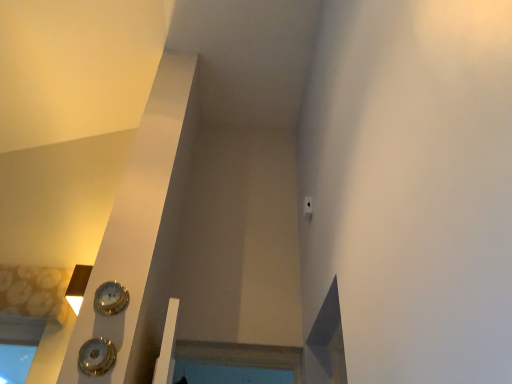
Question: Would you say gold metallic clock at lower left, the 2th clock when ordered from bottom to top, is outside shiny silver clock at lower left, which is the first clock in front-to-back order?

Choices:
 (A) yes
 (B) no

Answer: (A)

Question: From a real-world perspective, is gold metallic clock at lower left, acting as the 1th clock starting from the back, positioned over shiny silver clock at lower left, which is the first clock in front-to-back order, based on gravity?

Choices:
 (A) no
 (B) yes

Answer: (B)

Question: Is gold metallic clock at lower left, acting as the 1th clock starting from the back, not near shiny silver clock at lower left, placed as the second clock when sorted from top to bottom?

Choices:
 (A) yes
 (B) no

Answer: (B)

Question: From a real-world perspective, is gold metallic clock at lower left, which is the 1th clock from top to bottom, below shiny silver clock at lower left, placed as the second clock when sorted from top to bottom?

Choices:
 (A) yes
 (B) no

Answer: (B)

Question: Is the position of gold metallic clock at lower left, the 2th clock when ordered from bottom to top, more distant than that of shiny silver clock at lower left, the 2th clock from the back?

Choices:
 (A) yes
 (B) no

Answer: (A)

Question: Does gold metallic clock at lower left, the 2th clock when ordered from bottom to top, turn towards shiny silver clock at lower left, placed as the second clock when sorted from top to bottom?

Choices:
 (A) yes
 (B) no

Answer: (B)

Question: Is the depth of shiny silver clock at lower left, which is the first clock in front-to-back order, greater than that of gold metallic clock at lower left, acting as the 1th clock starting from the back?

Choices:
 (A) no
 (B) yes

Answer: (A)

Question: Does shiny silver clock at lower left, which is the first clock from bottom to top, appear on the left side of gold metallic clock at lower left, the 2th clock when ordered from bottom to top?

Choices:
 (A) yes
 (B) no

Answer: (A)

Question: Considering the relative positions of shiny silver clock at lower left, placed as the second clock when sorted from top to bottom, and gold metallic clock at lower left, the second clock when ordered from front to back, in the image provided, is shiny silver clock at lower left, placed as the second clock when sorted from top to bottom, in front of gold metallic clock at lower left, the second clock when ordered from front to back,?

Choices:
 (A) yes
 (B) no

Answer: (A)

Question: Does shiny silver clock at lower left, placed as the second clock when sorted from top to bottom, have a lesser width compared to gold metallic clock at lower left, which is the 1th clock from top to bottom?

Choices:
 (A) no
 (B) yes

Answer: (A)

Question: From the image's perspective, does shiny silver clock at lower left, which is the first clock from bottom to top, appear higher than gold metallic clock at lower left, the 2th clock when ordered from bottom to top?

Choices:
 (A) yes
 (B) no

Answer: (B)

Question: Does shiny silver clock at lower left, the 2th clock from the back, have a lesser height compared to gold metallic clock at lower left, which is the 1th clock from top to bottom?

Choices:
 (A) no
 (B) yes

Answer: (A)

Question: From the image's perspective, is shiny silver clock at lower left, the 2th clock from the back, positioned above or below gold metallic clock at lower left, acting as the 1th clock starting from the back?

Choices:
 (A) below
 (B) above

Answer: (A)